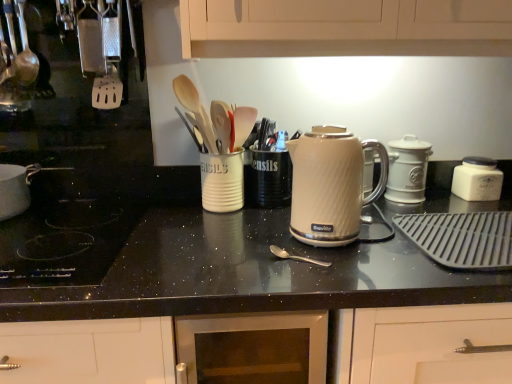
This screenshot has height=384, width=512. Find the location of `free spot in front of white ceramic container at right, which ranks as the 1th kitchen appliance in right-to-left order`. free spot in front of white ceramic container at right, which ranks as the 1th kitchen appliance in right-to-left order is located at coordinates (484, 203).